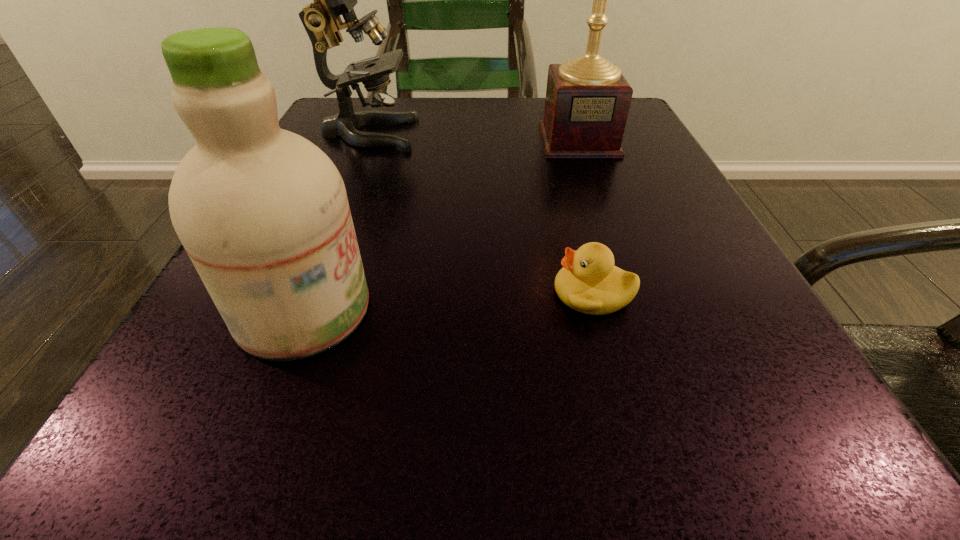
Find the location of a particular element. The height and width of the screenshot is (540, 960). unoccupied area between the tallest object and the microscope is located at coordinates 474,137.

Identify the location of vacant area that lies between the duckling and the trophy cup. The image size is (960, 540). (586, 217).

Locate an element on the screen. vacant area that lies between the duckling and the trophy cup is located at coordinates (586, 217).

Identify which object is the nearest to the microscope. Please provide its 2D coordinates. Your answer should be formatted as a tuple, i.e. [(x, y)], where the tuple contains the x and y coordinates of a point satisfying the conditions above.

[(587, 102)]

Choose which object is the nearest neighbor to the shortest object. Please provide its 2D coordinates. Your answer should be formatted as a tuple, i.e. [(x, y)], where the tuple contains the x and y coordinates of a point satisfying the conditions above.

[(262, 212)]

At what (x,y) coordinates should I click in order to perform the action: click on free space that satisfies the following two spatial constraints: 1. on the plaque of the tallest object; 2. at the face of the shortest object. Please return your answer as a coordinate pair (x, y). Looking at the image, I should click on (634, 293).

At what (x,y) coordinates should I click in order to perform the action: click on blank space that satisfies the following two spatial constraints: 1. on the plaque of the tallest object; 2. at the face of the shortest object. Please return your answer as a coordinate pair (x, y). The image size is (960, 540). Looking at the image, I should click on (634, 293).

The width and height of the screenshot is (960, 540). In order to click on free location that satisfies the following two spatial constraints: 1. on the plaque of the tallest object; 2. at the face of the duckling in this screenshot , I will do `click(634, 293)`.

The image size is (960, 540). In order to click on free space that satisfies the following two spatial constraints: 1. on the plaque of the tallest object; 2. at the face of the duckling in this screenshot , I will do `click(634, 293)`.